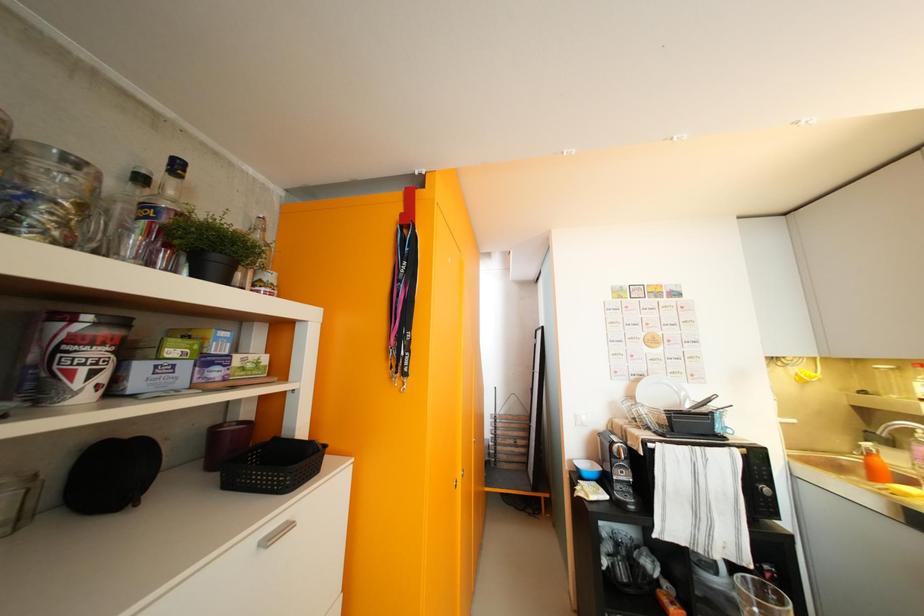
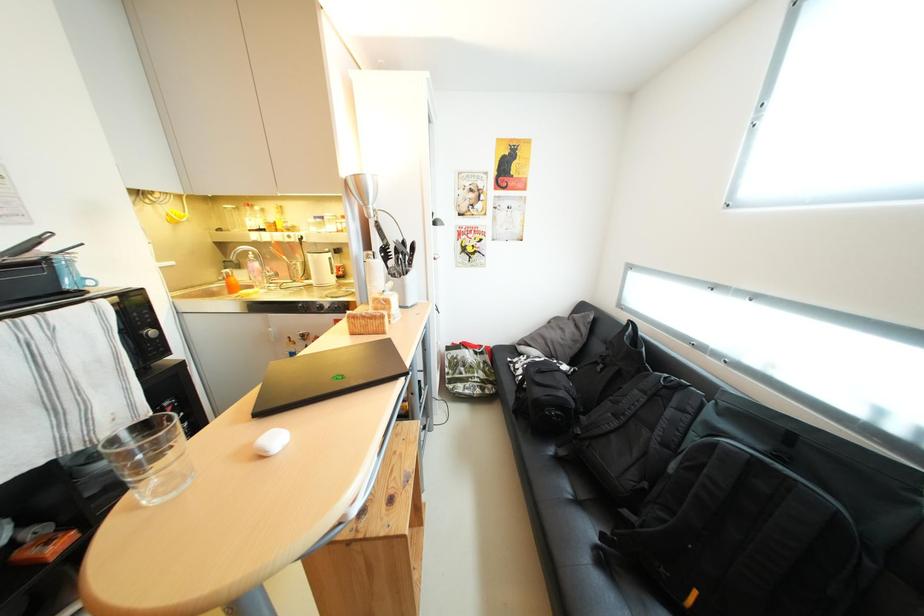
Based on the continuous images, in which direction is the camera rotating?

The rotation direction of the camera is right-down.